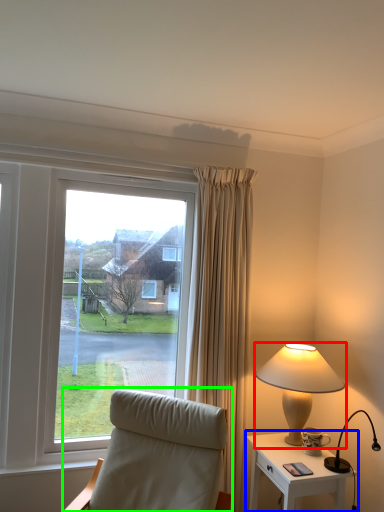
Question: Estimate the real-world distances between objects in this image. Which object is farther from lamp (highlighted by a red box), nightstand (highlighted by a blue box) or chair (highlighted by a green box)?

Choices:
 (A) nightstand
 (B) chair

Answer: (B)